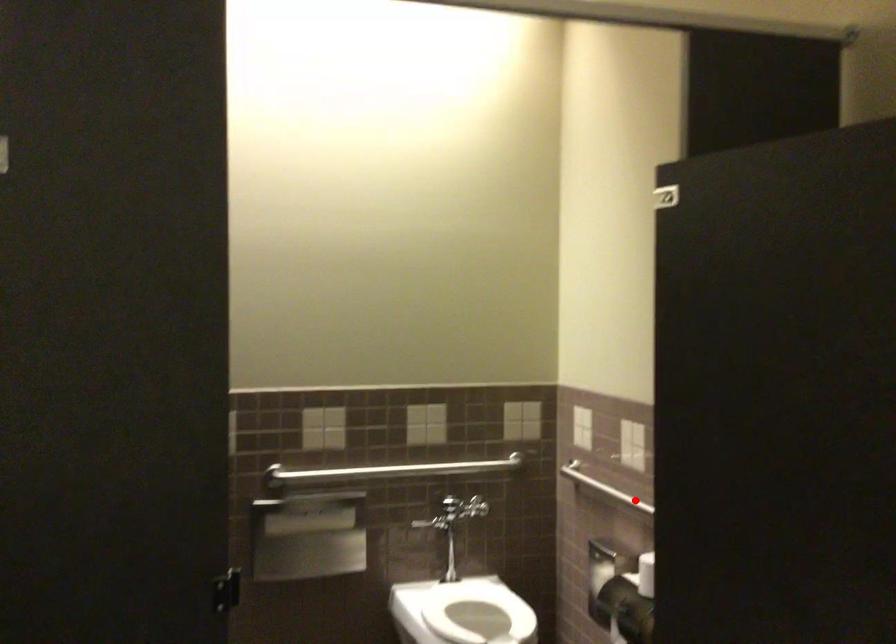
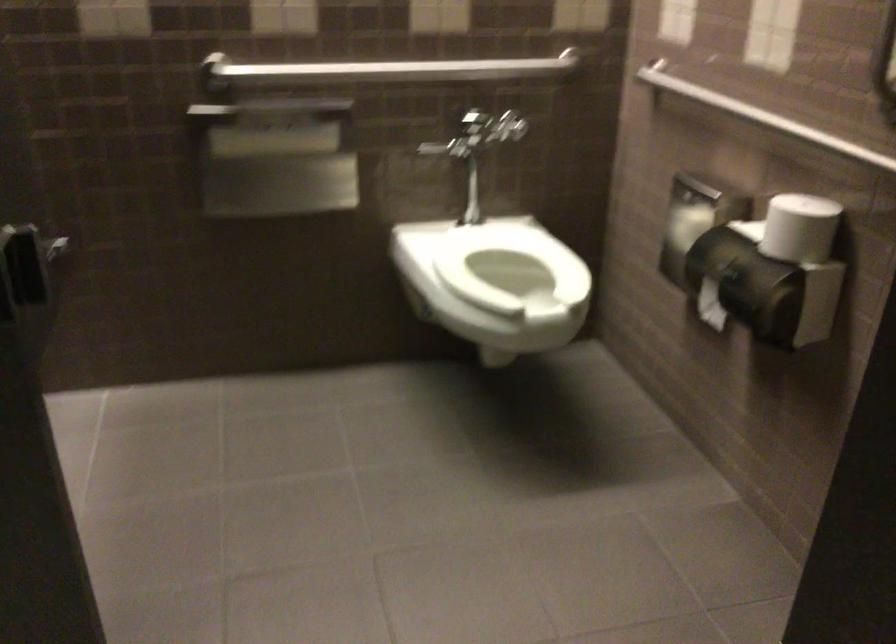
Locate, in the second image, the point that corresponds to the highlighted location in the first image.

(761, 116)